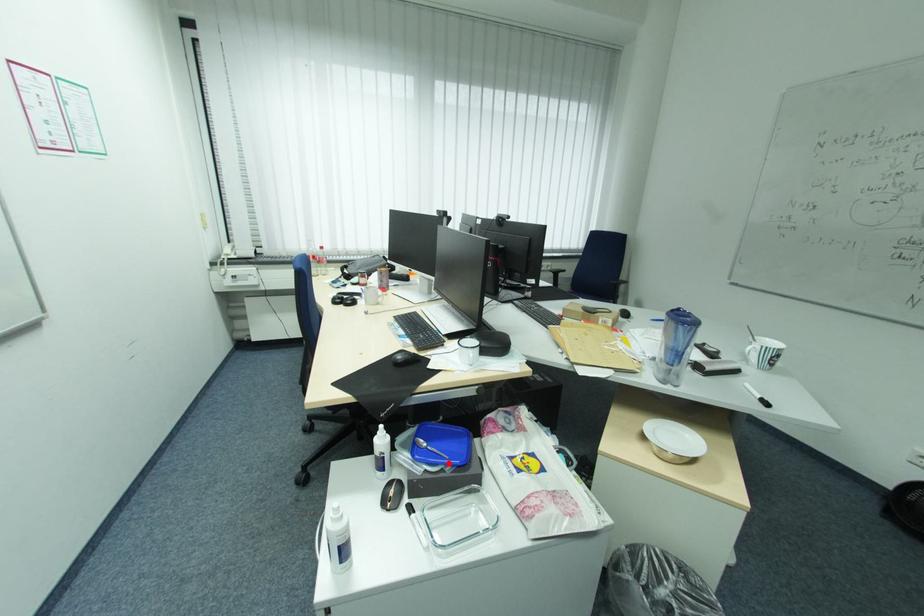
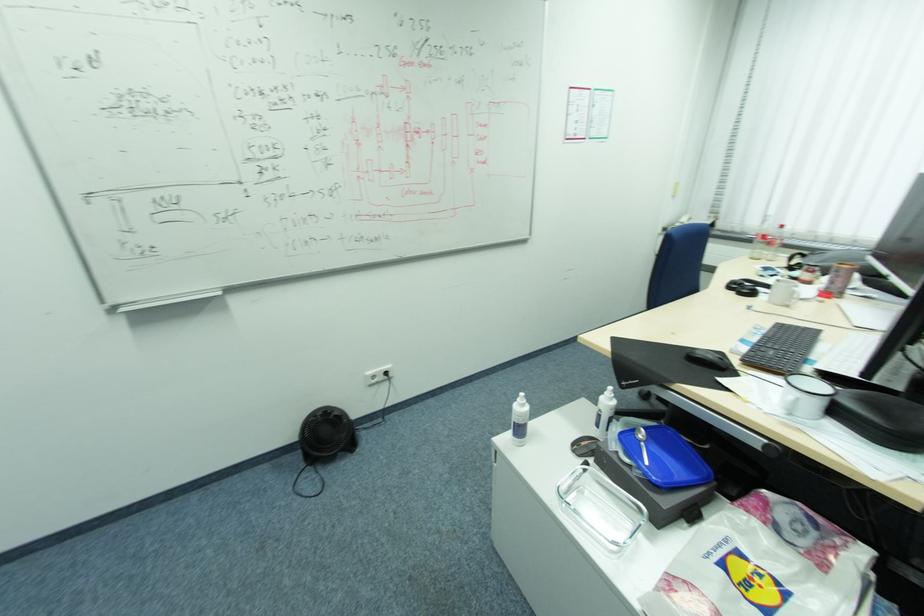
Locate, in the second image, the point that corresponds to the highlighted location in the first image.

(642, 463)